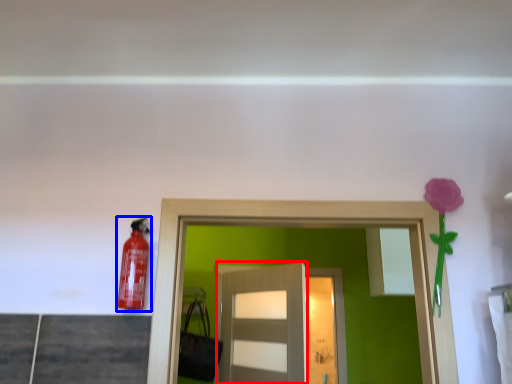
Question: Which point is closer to the camera, door (highlighted by a red box) or extinguisher (highlighted by a blue box)?

Choices:
 (A) door
 (B) extinguisher

Answer: (B)